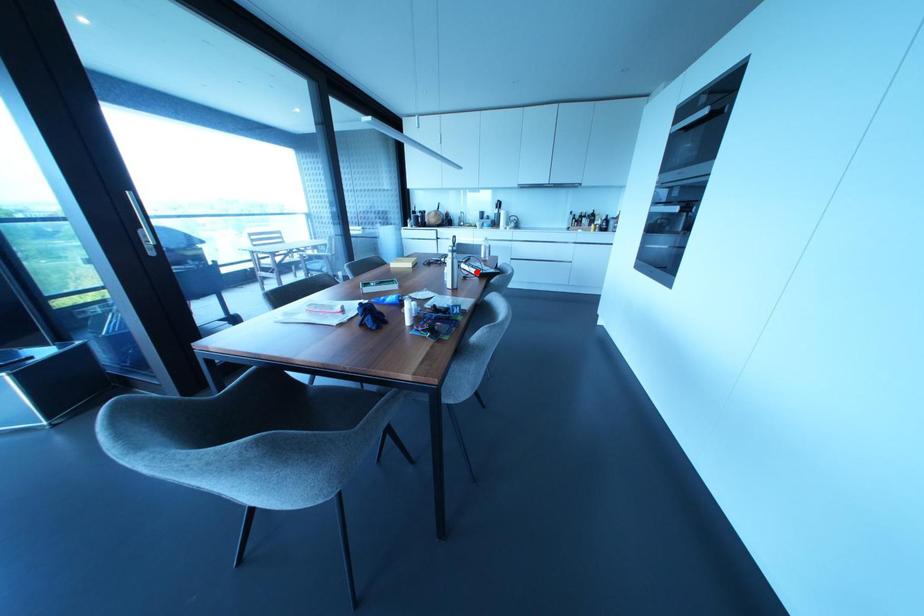
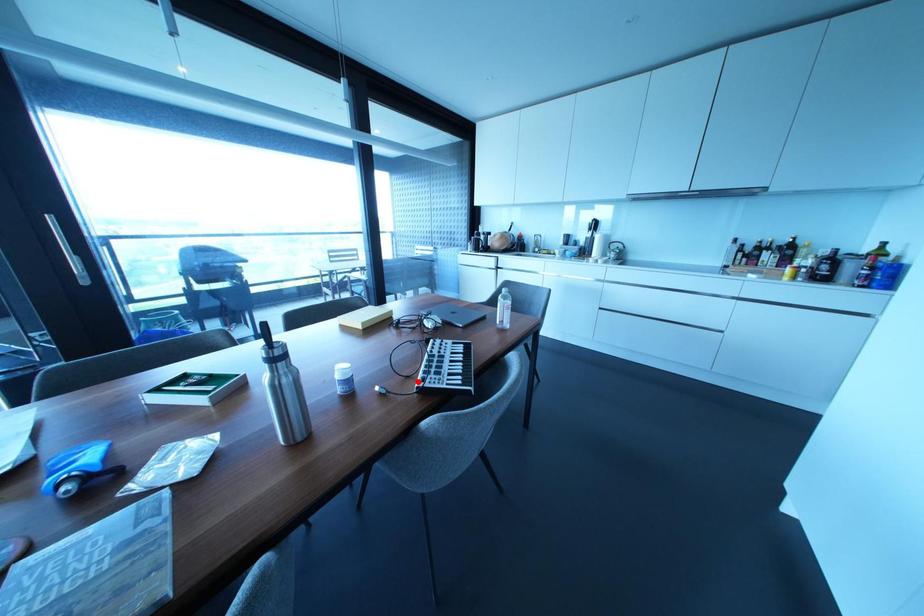
I am providing you with two images of the same scene from different viewpoints. A red point is marked on the first image and another point is marked on the second image. Does the point marked in image1 correspond to the same location as the one in image2?

Yes